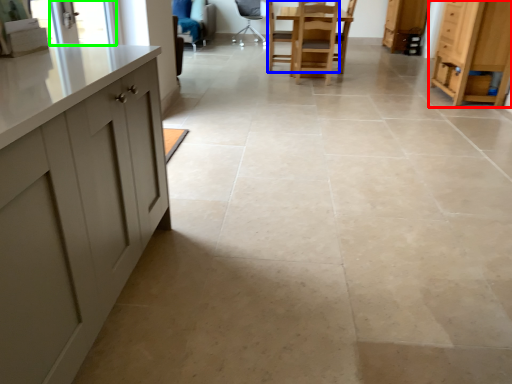
Question: Considering the real-world distances, which object is closest to cabinetry (highlighted by a red box)? chair (highlighted by a blue box) or window screen (highlighted by a green box).

Choices:
 (A) chair
 (B) window screen

Answer: (A)